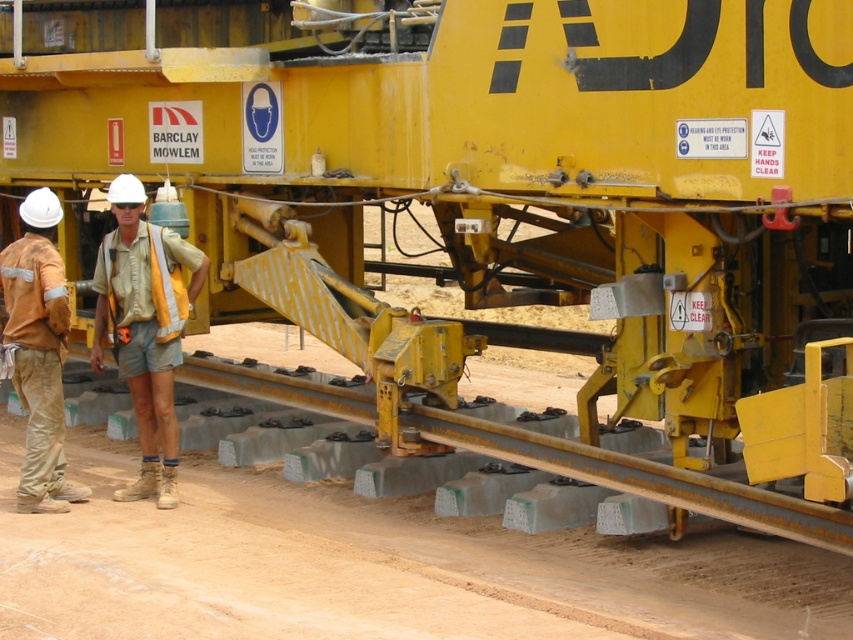
You are a safety inspector checking the construction site. You notice two workers wearing camouflage fabric shirt at center and orange fabric pants at left. Which worker should you approach first based on their clothing width?

The camouflage fabric shirt at center might be wider than orange fabric pants at left, so you should approach the worker wearing the camouflage fabric shirt at center first to ensure their safety gear is properly fitted.